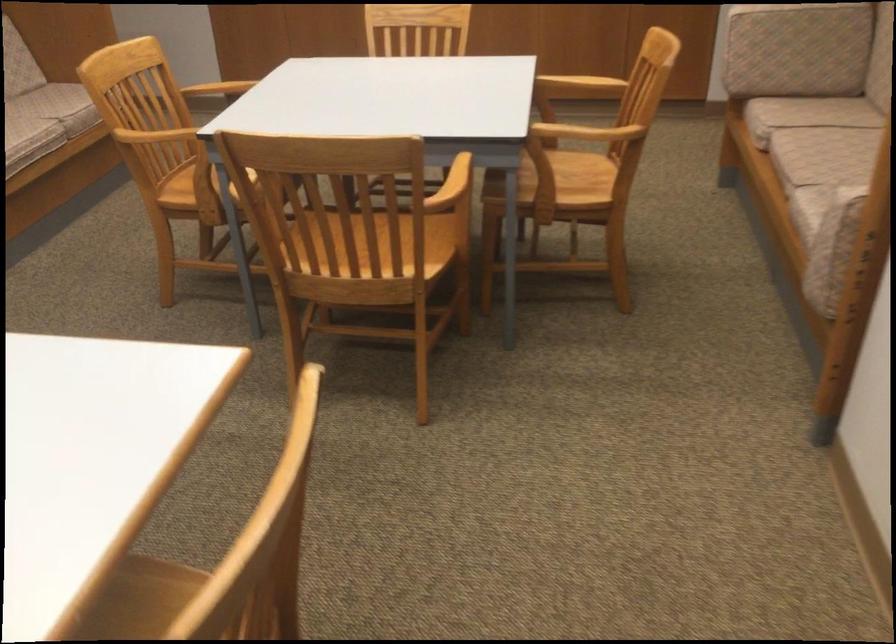
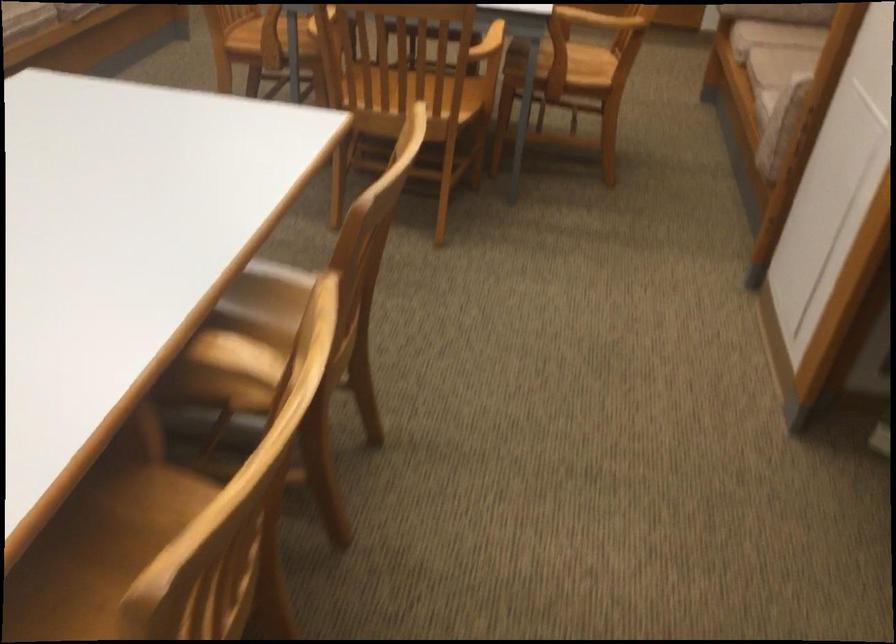
Find the pixel in the second image that matches point (458, 187) in the first image.

(488, 43)